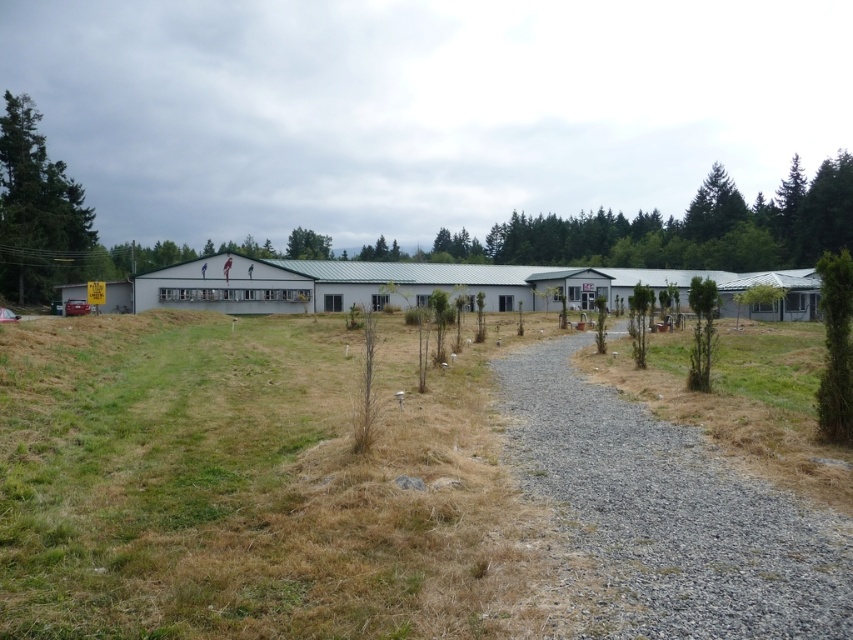
You are a gardener planning to plant a new tree between the green textured tree at right and the green textured tree at upper right. Which tree should you use as a reference to ensure the new tree is spaced appropriately for growth, considering the existing trees?

You should use the green textured tree at upper right as a reference because it has a greater width than the green textured tree at right, ensuring proper spacing for the new tree.

From the picture: You are a gardener who needs to decide where to water first. Which area is larger in size between the brown dry grass at lower left and the gray gravel path at center?

The brown dry grass at lower left is bigger than the gray gravel path at center, so you should water the larger area first.

You are standing at the entrance of the building and want to walk to the brown dry grass at lower left. Which direction should you walk to avoid stepping on the gray gravel path at center?

To reach the brown dry grass at lower left without stepping on the gray gravel path at center, you should walk towards the left side since the gray gravel path at center is behind the brown dry grass at lower left, meaning the path is located further back from your current position.